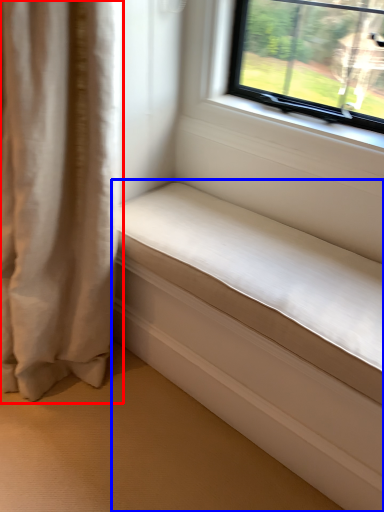
Question: Which point is further to the camera, curtain (highlighted by a red box) or studio couch (highlighted by a blue box)?

Choices:
 (A) curtain
 (B) studio couch

Answer: (B)